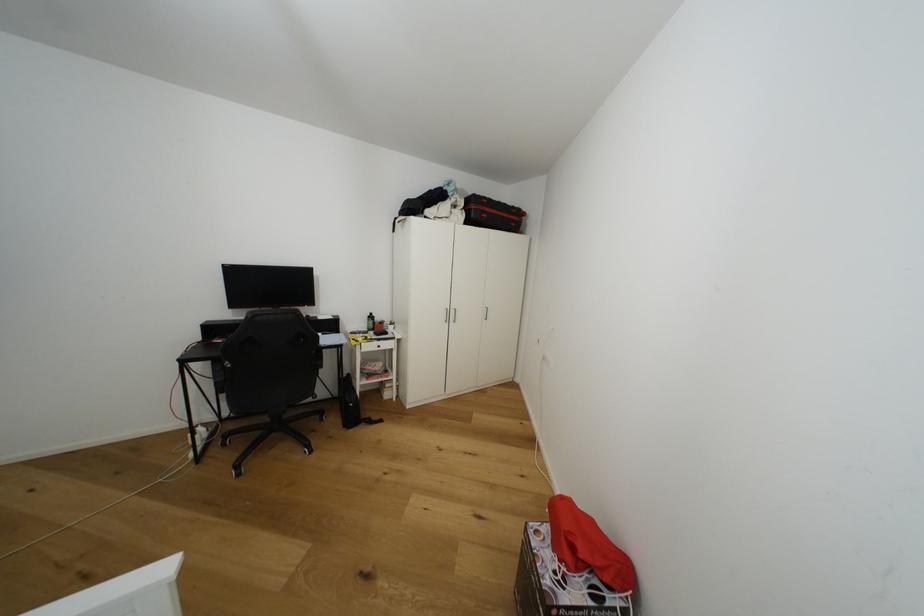
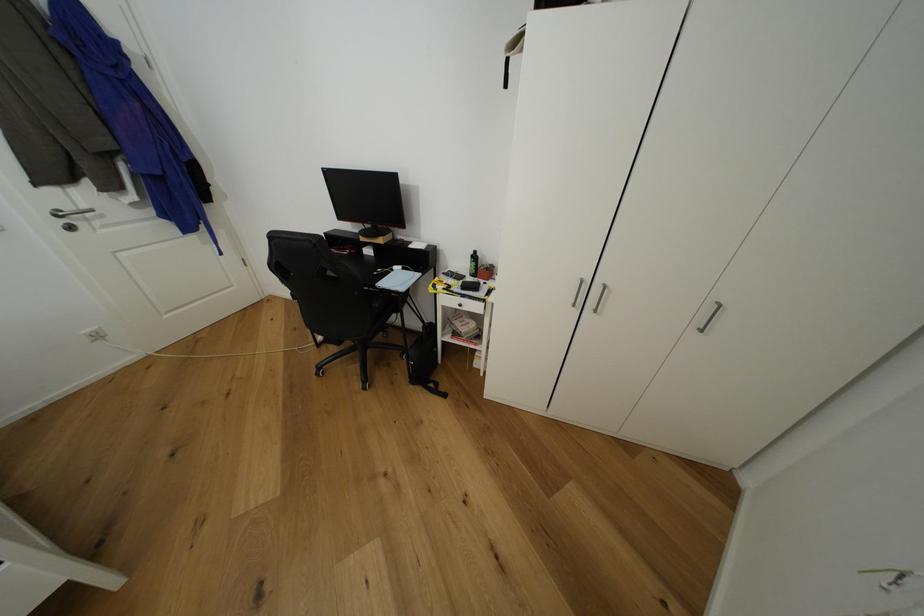
Locate, in the second image, the point that corresponds to [379,365] in the first image.

(472, 322)